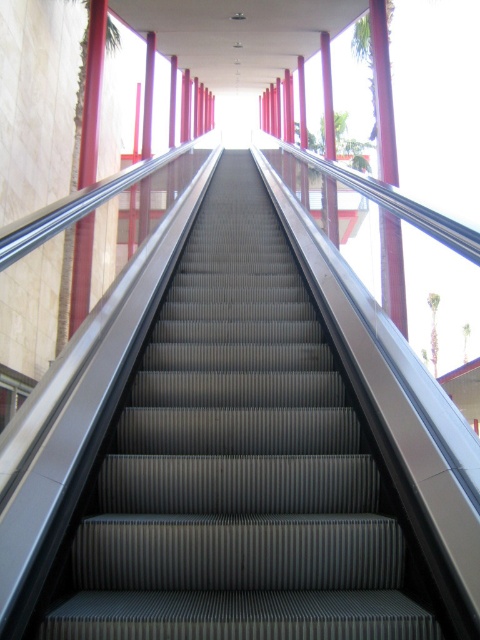
This screenshot has width=480, height=640. What do you see at coordinates (238, 465) in the screenshot?
I see `metallic gray escalator steps at center` at bounding box center [238, 465].

Between point (222, 212) and point (377, 51), which one is positioned behind?

The point (222, 212) is behind.

Locate an element on the screen. This screenshot has width=480, height=640. metallic gray escalator steps at center is located at coordinates (238, 465).